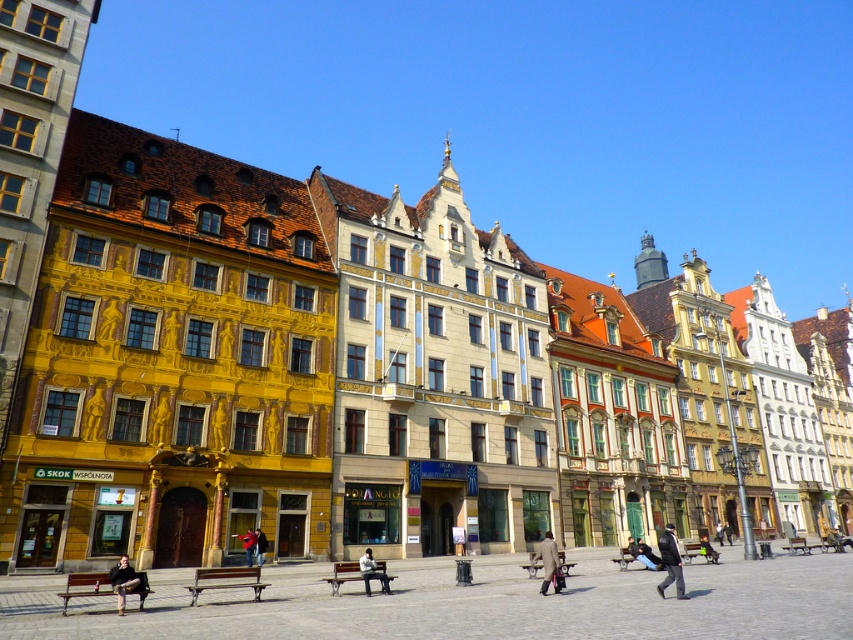
Question: Can you confirm if light brown wooden bench at center is bigger than red jacket at center?

Choices:
 (A) yes
 (B) no

Answer: (A)

Question: Which point is farther from the camera taking this photo?

Choices:
 (A) (248, 545)
 (B) (363, 573)
 (C) (262, 532)

Answer: (C)

Question: Is light brown leather coat at lower right bigger than light brown wooden bench at center?

Choices:
 (A) yes
 (B) no

Answer: (A)

Question: Which point is farther to the camera?

Choices:
 (A) (265, 547)
 (B) (544, 556)

Answer: (A)

Question: Which object appears closest to the camera in this image?

Choices:
 (A) light brown wooden bench at center
 (B) red leather jacket at center
 (C) dark blue jacket at center
 (D) red jacket at center

Answer: (C)

Question: Can you confirm if red leather jacket at center is smaller than red jacket at center?

Choices:
 (A) no
 (B) yes

Answer: (A)